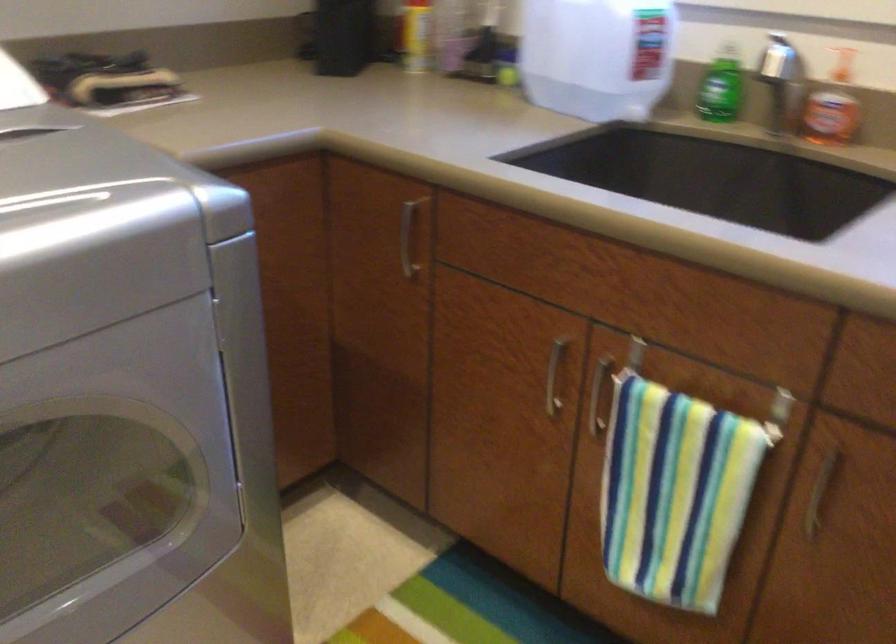
This screenshot has width=896, height=644. I want to click on orange soap bottle, so (832, 106).